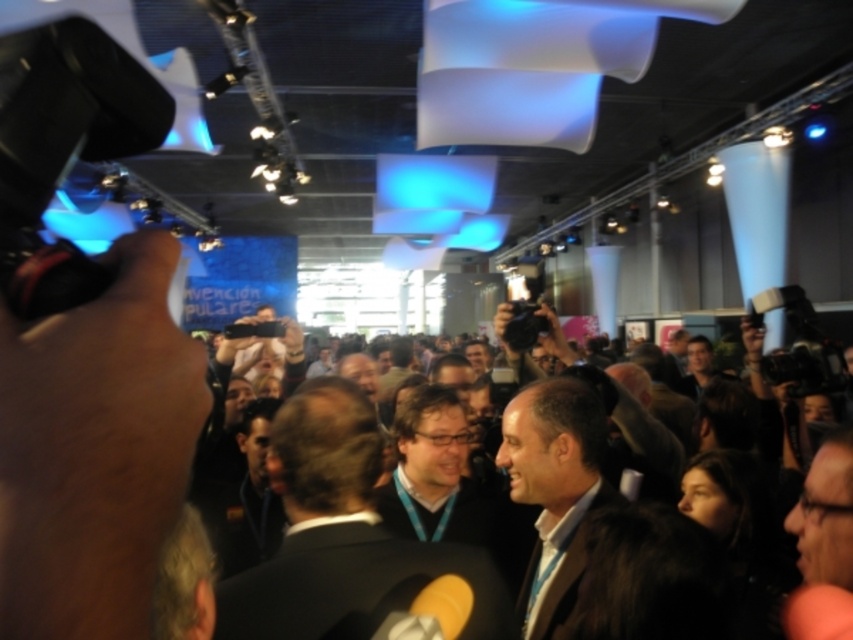
Is point (451, 538) farther from viewer compared to point (840, 445)?

Yes, point (451, 538) is behind point (840, 445).

Between point (445, 467) and point (819, 518), which one is positioned behind?

Positioned behind is point (445, 467).

Is point (428, 508) positioned in front of point (846, 513)?

No, (428, 508) is further to viewer.

I want to click on matte black jacket at center, so click(x=434, y=474).

This screenshot has height=640, width=853. What are the coordinates of `dark suit jacket at center` in the screenshot? It's located at (809, 371).

Does point (398, 525) come in front of point (822, 451)?

No, (398, 525) is behind (822, 451).

Is point (798, 346) positioned after point (813, 596)?

Yes, it is behind point (813, 596).

You are a GUI agent. You are given a task and a screenshot of the screen. Output one action in this format:
    pyautogui.click(x=<x>, y=<y>)
    Task: Click on the dark suit jacket at center
    The height and width of the screenshot is (640, 853).
    Given the screenshot: What is the action you would take?
    pyautogui.click(x=809, y=371)

Which is behind, point (316, 435) or point (492, 528)?

Positioned behind is point (492, 528).

Who is higher up, black suit at center or matte black jacket at center?

Positioned higher is black suit at center.

You are a GUI agent. You are given a task and a screenshot of the screen. Output one action in this format:
    pyautogui.click(x=<x>, y=<y>)
    Task: Click on the black suit at center
    Image resolution: width=853 pixels, height=640 pixels.
    Given the screenshot: What is the action you would take?
    pyautogui.click(x=343, y=536)